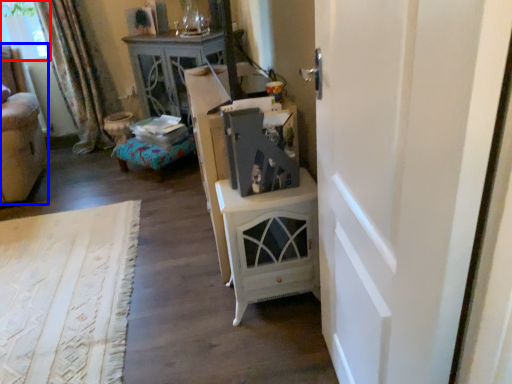
Question: Which point is further to the camera, window screen (highlighted by a red box) or furniture (highlighted by a blue box)?

Choices:
 (A) window screen
 (B) furniture

Answer: (A)